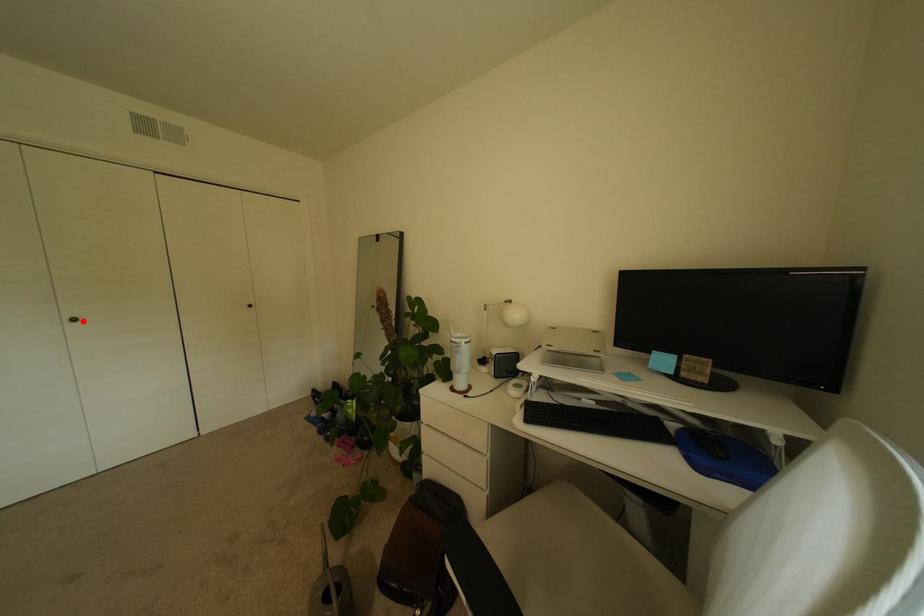
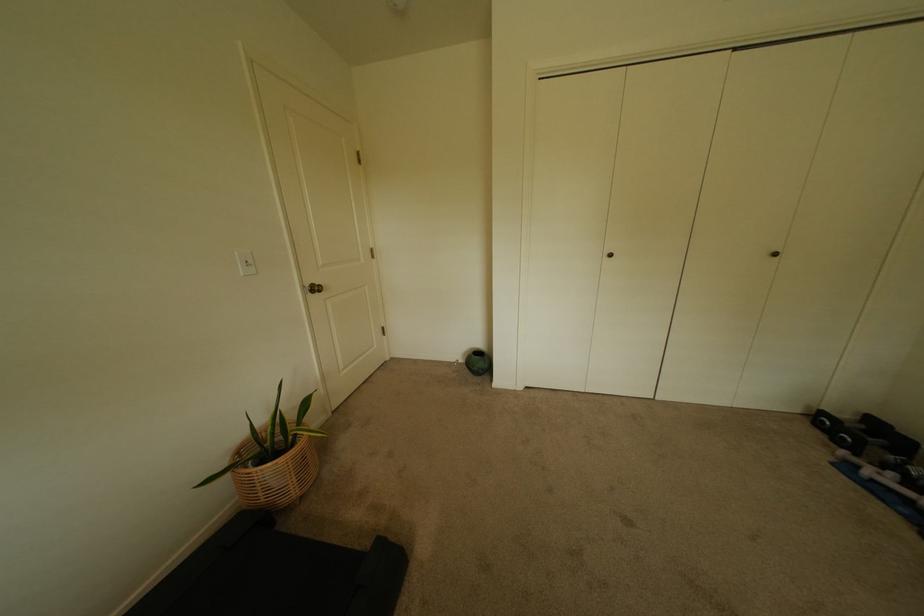
Find the pixel in the second image that matches the highlighted location in the first image.

(618, 256)